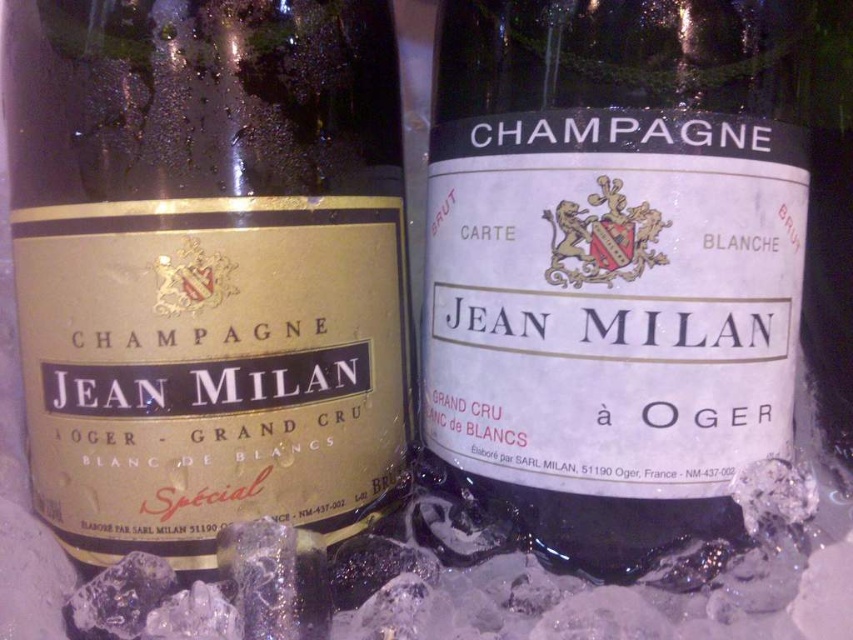
You are a bartender standing at the counter and see the gold matte champagne bottle at center. If you want to grab it, will you be able to reach it?

The gold matte champagne bottle at center is 27.96 inches from viewer, so yes, you can reach it as it is within a typical arm reach distance.

You are at a wine tasting event and want to pick up the gold matte champagne bottle at center and the white matte champagne bottle at center. Which one do you need to reach further to grab?

The white matte champagne bottle at center is further away from you, so you need to reach further to grab it.